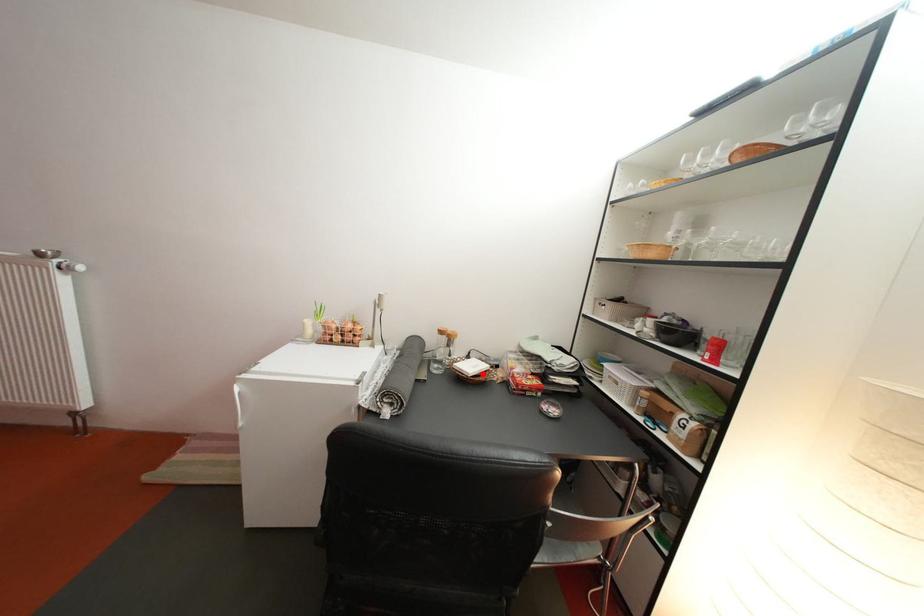
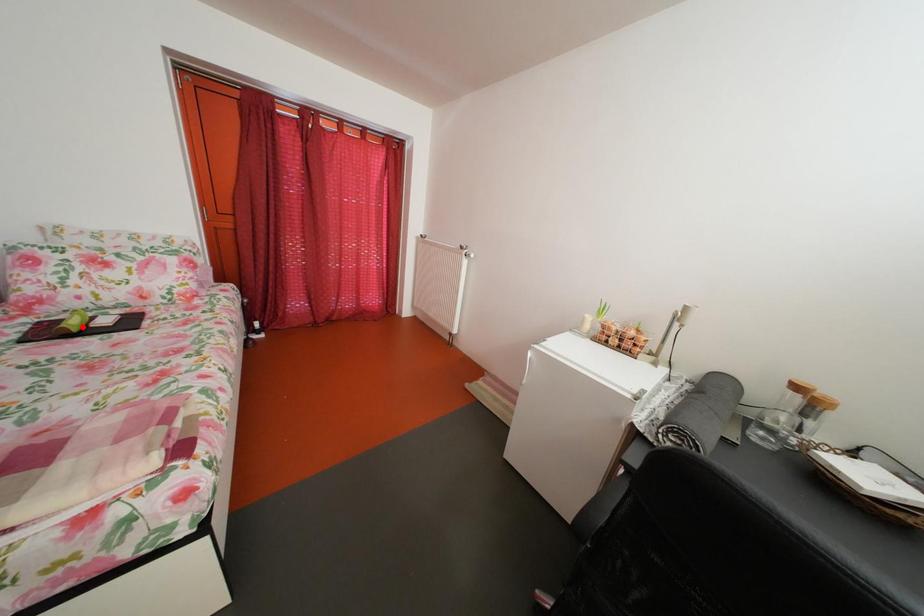
From the picture: I am providing you with two images of the same scene from different viewpoints. A red point is marked on the first image and another point is marked on the second image. Are the points marked in image1 and image2 representing the same 3D position?

No